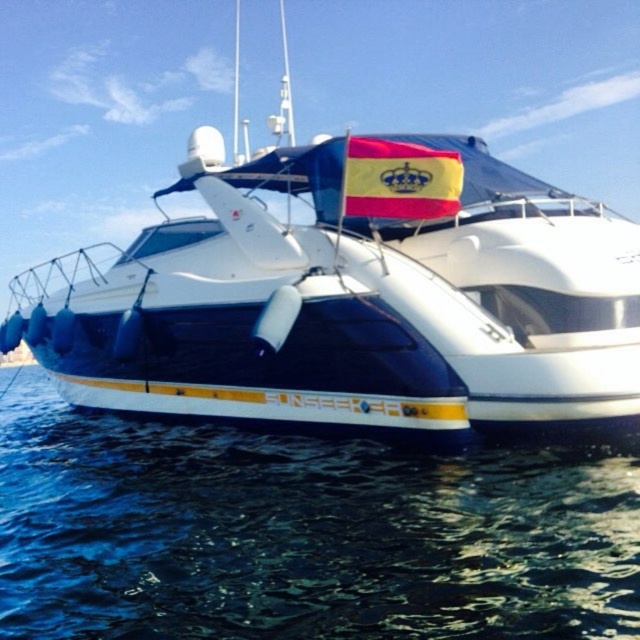
Question: Which point appears farthest from the camera in this image?

Choices:
 (A) (467, 522)
 (B) (220, 253)

Answer: (B)

Question: Can you confirm if white glossy boat at center is positioned below blue water at lower left?

Choices:
 (A) no
 (B) yes

Answer: (A)

Question: Does white glossy boat at center have a larger size compared to blue water at lower left?

Choices:
 (A) no
 (B) yes

Answer: (B)

Question: From the image, what is the correct spatial relationship of white glossy boat at center in relation to red fabric flag at center?

Choices:
 (A) left
 (B) right

Answer: (A)

Question: Among these points, which one is nearest to the camera?

Choices:
 (A) (529, 531)
 (B) (376, 410)
 (C) (376, 204)

Answer: (A)

Question: Which of the following is the closest to the observer?

Choices:
 (A) blue water at lower left
 (B) red fabric flag at center
 (C) white glossy boat at center

Answer: (A)